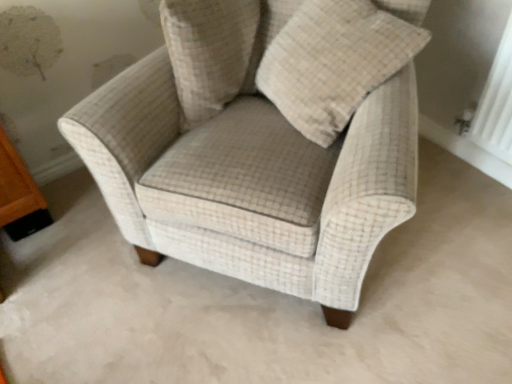
Question: Considering the positions of beige checkered pillow at center and beige checkered armchair at center in the image, is beige checkered pillow at center wider or thinner than beige checkered armchair at center?

Choices:
 (A) wide
 (B) thin

Answer: (B)

Question: Is beige checkered pillow at center spatially inside beige checkered armchair at center, or outside of it?

Choices:
 (A) inside
 (B) outside

Answer: (A)

Question: Which object is positioned farthest from the beige checkered pillow at center?

Choices:
 (A) beige checkered pillow at upper center
 (B) beige checkered armchair at center

Answer: (A)

Question: Which object is the closest to the beige checkered pillow at center?

Choices:
 (A) beige checkered pillow at upper center
 (B) beige checkered armchair at center

Answer: (B)